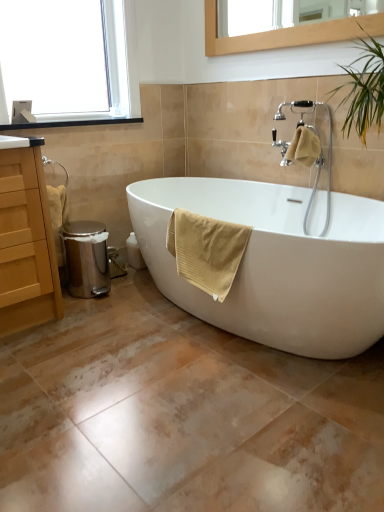
Describe the element at coordinates (58, 216) in the screenshot. I see `metallic trash can at left` at that location.

Measure the distance between white glossy bathtub at center and camera.

white glossy bathtub at center is 4.70 feet away from camera.

Describe the element at coordinates (287, 34) in the screenshot. I see `wooden-framed mirror at upper center` at that location.

Describe the element at coordinates (206, 250) in the screenshot. The height and width of the screenshot is (512, 384). I see `yellow cotton towel at lower center, which is the first bath towel in left-to-right order` at that location.

Describe the element at coordinates (26, 242) in the screenshot. The image size is (384, 512). I see `matte wood cabinet at left` at that location.

Where is `yellow textured towel at upper right, the 2th bath towel from the left`? yellow textured towel at upper right, the 2th bath towel from the left is located at coordinates (304, 146).

Locate an element on the screen. This screenshot has width=384, height=512. metallic trash can at left is located at coordinates (58, 216).

In the scene shown: Can you see wooden-framed mirror at upper center touching clear glass window at upper left?

No.

Considering the sizes of objects wooden-framed mirror at upper center and clear glass window at upper left in the image provided, who is bigger, wooden-framed mirror at upper center or clear glass window at upper left?

Bigger between the two is clear glass window at upper left.

Is wooden-framed mirror at upper center to the left of clear glass window at upper left from the viewer's perspective?

In fact, wooden-framed mirror at upper center is to the right of clear glass window at upper left.

Is wooden-framed mirror at upper center taller or shorter than clear glass window at upper left?

wooden-framed mirror at upper center is shorter than clear glass window at upper left.

Consider the image. Measure the distance from clear glass window at upper left to yellow textured towel at upper right, the 2th bath towel from the left.

clear glass window at upper left is 4.28 feet from yellow textured towel at upper right, the 2th bath towel from the left.

Is clear glass window at upper left in front of or behind yellow textured towel at upper right, the second bath towel positioned from the bottom, in the image?

clear glass window at upper left is positioned closer to the viewer than yellow textured towel at upper right, the second bath towel positioned from the bottom.

Locate an element on the screen. This screenshot has width=384, height=512. window above the yellow textured towel at upper right, acting as the first bath towel starting from the right (from the image's perspective) is located at coordinates (68, 61).

Who is smaller, clear glass window at upper left or yellow textured towel at upper right, acting as the 2th bath towel starting from the front?

yellow textured towel at upper right, acting as the 2th bath towel starting from the front.

In the scene shown: Is yellow cotton towel at lower center, which is the first bath towel in left-to-right order, placed right next to metallic trash can at left?

No, yellow cotton towel at lower center, which is the first bath towel in left-to-right order, is not next to metallic trash can at left.

Locate an element on the screen. This screenshot has height=512, width=384. material above the yellow cotton towel at lower center, marked as the first bath towel in a bottom-to-top arrangement (from the image's perspective) is located at coordinates (58, 216).

How far apart are yellow cotton towel at lower center, marked as the first bath towel in a bottom-to-top arrangement, and metallic trash can at left?

The distance of yellow cotton towel at lower center, marked as the first bath towel in a bottom-to-top arrangement, from metallic trash can at left is 29.15 inches.

Is point (211, 234) more distant than point (50, 196)?

No, it is not.

Does clear glass window at upper left have a lesser height compared to wooden-framed mirror at upper center?

No.

I want to click on mirror that appears on the right of clear glass window at upper left, so click(x=287, y=34).

Looking at this image, can you tell me how much clear glass window at upper left and wooden-framed mirror at upper center differ in facing direction?

There is a 89.3-degree angle between the facing directions of clear glass window at upper left and wooden-framed mirror at upper center.

From a real-world perspective, which is physically above, clear glass window at upper left or wooden-framed mirror at upper center?

wooden-framed mirror at upper center, from a real-world perspective.

Find the location of a particular element. bathtub located on the right of matte wood cabinet at left is located at coordinates (276, 262).

Based on the photo, between matte wood cabinet at left and white glossy bathtub at center, which one has more height?

matte wood cabinet at left is taller.

How different are the orientations of matte wood cabinet at left and white glossy bathtub at center in degrees?

The angular difference between matte wood cabinet at left and white glossy bathtub at center is 90.4 degrees.

In order to click on bath towel that is the 2nd object located in front of the metallic trash can at left in this screenshot , I will do `click(206, 250)`.

Is yellow cotton towel at lower center, positioned as the second bath towel in back-to-front order, at the back of metallic trash can at left?

metallic trash can at left is not turned away from yellow cotton towel at lower center, positioned as the second bath towel in back-to-front order.

Which of these two, metallic trash can at left or yellow cotton towel at lower center, which is the first bath towel in left-to-right order, is smaller?

metallic trash can at left is smaller.

What's the angular difference between metallic trash can at left and yellow cotton towel at lower center, marked as the first bath towel in a bottom-to-top arrangement,'s facing directions?

87.3 degrees.

Considering the sizes of objects yellow cotton towel at lower center, positioned as the second bath towel in back-to-front order, and wooden-framed mirror at upper center in the image provided, who is smaller, yellow cotton towel at lower center, positioned as the second bath towel in back-to-front order, or wooden-framed mirror at upper center?

With smaller size is wooden-framed mirror at upper center.

Is yellow cotton towel at lower center, positioned as the second bath towel in top-to-bottom order, beside wooden-framed mirror at upper center?

No, yellow cotton towel at lower center, positioned as the second bath towel in top-to-bottom order, is not next to wooden-framed mirror at upper center.

Considering the relative sizes of yellow cotton towel at lower center, positioned as the second bath towel in back-to-front order, and wooden-framed mirror at upper center in the image provided, is yellow cotton towel at lower center, positioned as the second bath towel in back-to-front order, wider than wooden-framed mirror at upper center?

Indeed, yellow cotton towel at lower center, positioned as the second bath towel in back-to-front order, has a greater width compared to wooden-framed mirror at upper center.

From the picture: Would you say yellow cotton towel at lower center, positioned as the first bath towel in front-to-back order, is inside or outside wooden-framed mirror at upper center?

yellow cotton towel at lower center, positioned as the first bath towel in front-to-back order, lies outside wooden-framed mirror at upper center.

I want to click on mirror that appears in front of the clear glass window at upper left, so click(x=287, y=34).

There is a yellow textured towel at upper right, which is the first bath towel from back to front. At what (x,y) coordinates should I click in order to perform the action: click on window above it (from a real-world perspective). Please return your answer as a coordinate pair (x, y). The width and height of the screenshot is (384, 512). Looking at the image, I should click on (68, 61).

Which object lies further to the anchor point wooden-framed mirror at upper center, white glossy bathtub at center or matte wood cabinet at left?

matte wood cabinet at left.

Considering their positions, is clear glass window at upper left positioned closer to white glossy bathtub at center than matte wood cabinet at left?

matte wood cabinet at left is positioned closer to the anchor white glossy bathtub at center.

Based on their spatial positions, is yellow cotton towel at lower center, positioned as the second bath towel in back-to-front order, or metallic trash can at left closer to yellow textured towel at upper right, acting as the first bath towel starting from the right?

The object closer to yellow textured towel at upper right, acting as the first bath towel starting from the right, is yellow cotton towel at lower center, positioned as the second bath towel in back-to-front order.

In the scene shown: Which object lies nearer to the anchor point yellow cotton towel at lower center, positioned as the second bath towel in top-to-bottom order, metallic trash can at left or white glossy bathtub at center?

The object closer to yellow cotton towel at lower center, positioned as the second bath towel in top-to-bottom order, is white glossy bathtub at center.

Consider the image. When comparing their distances from yellow textured towel at upper right, acting as the 2th bath towel starting from the front, does yellow cotton towel at lower center, marked as the first bath towel in a bottom-to-top arrangement, or matte wood cabinet at left seem closer?

The object closer to yellow textured towel at upper right, acting as the 2th bath towel starting from the front, is yellow cotton towel at lower center, marked as the first bath towel in a bottom-to-top arrangement.

In the scene shown: Considering their positions, is yellow textured towel at upper right, the second bath towel positioned from the bottom, positioned further to matte wood cabinet at left than clear glass window at upper left?

Among the two, yellow textured towel at upper right, the second bath towel positioned from the bottom, is located further to matte wood cabinet at left.

Looking at the image, which one is located closer to matte wood cabinet at left, metallic trash can at left or clear glass window at upper left?

metallic trash can at left is positioned closer to the anchor matte wood cabinet at left.

From the image, which object appears to be farther from yellow cotton towel at lower center, marked as the first bath towel in a bottom-to-top arrangement, metallic trash can at left or clear glass window at upper left?

Based on the image, clear glass window at upper left appears to be further to yellow cotton towel at lower center, marked as the first bath towel in a bottom-to-top arrangement.

Locate an element on the screen. The height and width of the screenshot is (512, 384). material located between matte wood cabinet at left and white glossy bathtub at center in the left-right direction is located at coordinates (58, 216).

Locate an element on the screen. The height and width of the screenshot is (512, 384). bathtub between clear glass window at upper left and yellow cotton towel at lower center, which is the first bath towel in left-to-right order, in the up-down direction is located at coordinates (276, 262).

Locate an element on the screen. The height and width of the screenshot is (512, 384). bath towel situated between matte wood cabinet at left and wooden-framed mirror at upper center from left to right is located at coordinates (206, 250).

Where is `bath towel positioned between white glossy bathtub at center and yellow textured towel at upper right, the 2th bath towel from the left, from near to far`? bath towel positioned between white glossy bathtub at center and yellow textured towel at upper right, the 2th bath towel from the left, from near to far is located at coordinates (206, 250).